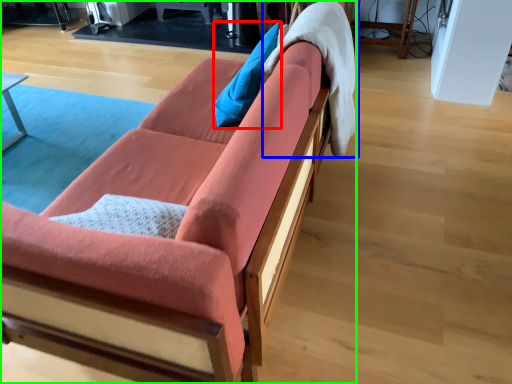
Question: Considering the real-world distances, which object is closest to pillow (highlighted by a red box)? blanket (highlighted by a blue box) or studio couch (highlighted by a green box).

Choices:
 (A) blanket
 (B) studio couch

Answer: (A)